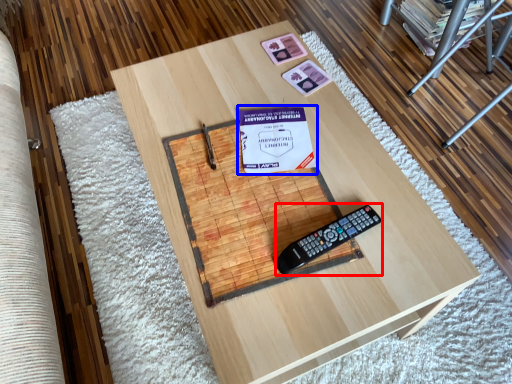
Question: Which point is further to the camera, equipment (highlighted by a red box) or paperback book (highlighted by a blue box)?

Choices:
 (A) equipment
 (B) paperback book

Answer: (B)